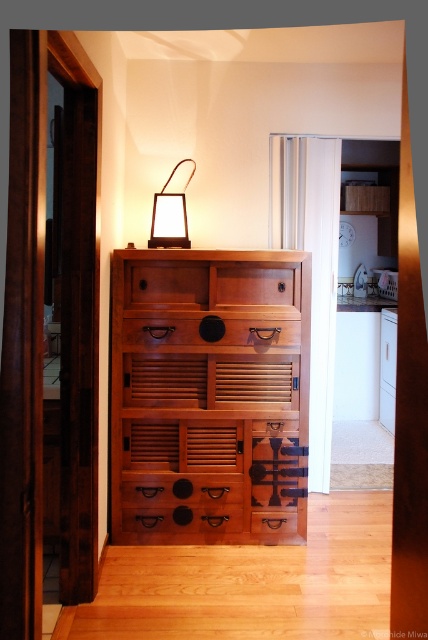
The width and height of the screenshot is (428, 640). Describe the element at coordinates (208, 332) in the screenshot. I see `wooden drawer at center` at that location.

Who is more forward, (130, 323) or (165, 513)?

Point (130, 323) is in front.

The height and width of the screenshot is (640, 428). I want to click on wooden drawer at center, so click(208, 332).

Is point (222, 525) behind point (158, 202)?

No, it is not.

In order to click on matte brown drawer at center in this screenshot , I will do `click(184, 518)`.

Find the location of a particular element. matte brown drawer at center is located at coordinates coord(184,518).

Is wooden drawer at center bigger than matte black lamp at upper center?

Incorrect, wooden drawer at center is not larger than matte black lamp at upper center.

Identify the location of wooden drawer at center. (208, 332).

What do you see at coordinates (208, 332) in the screenshot? The width and height of the screenshot is (428, 640). I see `wooden drawer at center` at bounding box center [208, 332].

The height and width of the screenshot is (640, 428). I want to click on wooden drawer at center, so click(x=208, y=332).